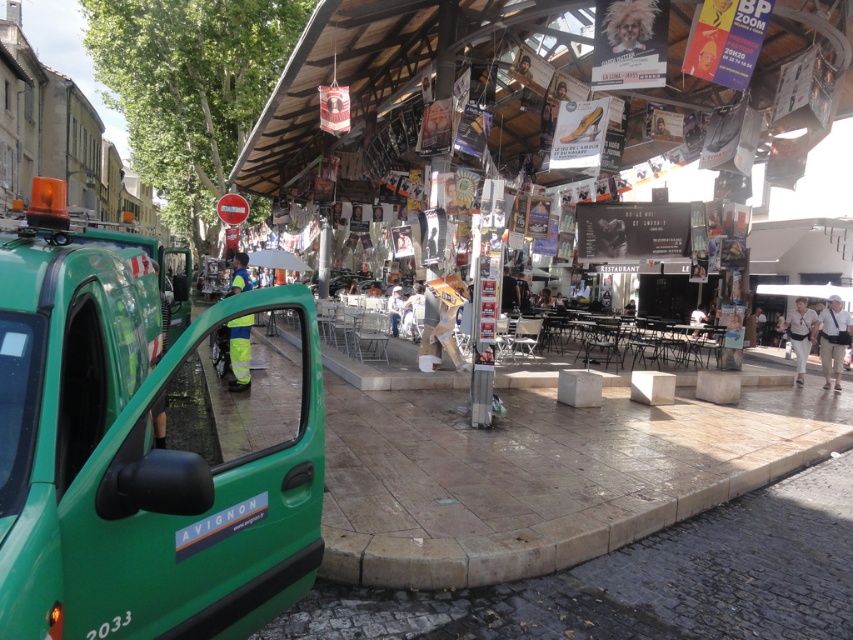
Question: Among these objects, which one is farthest from the camera?

Choices:
 (A) curly blonde hair at upper center
 (B) green matte taxi at left
 (C) light blue shirt at center
 (D) high visibility fabric vest at center

Answer: (C)

Question: Does green matte taxi at left lie behind curly blonde hair at upper center?

Choices:
 (A) yes
 (B) no

Answer: (B)

Question: Does high visibility fabric vest at center have a smaller size compared to light blue shirt at center?

Choices:
 (A) yes
 (B) no

Answer: (A)

Question: Is the position of green matte taxi at left less distant than that of high visibility fabric vest at center?

Choices:
 (A) yes
 (B) no

Answer: (A)

Question: Among these points, which one is farthest from the camera?

Choices:
 (A) (851, 326)
 (B) (392, 316)
 (C) (718, 353)
 (D) (135, 438)

Answer: (B)

Question: Based on their relative distances, which object is farther from the light beige cotton pants at lower right?

Choices:
 (A) light blue shirt at center
 (B) green matte taxi at left
 (C) white fabric bag at lower right

Answer: (B)